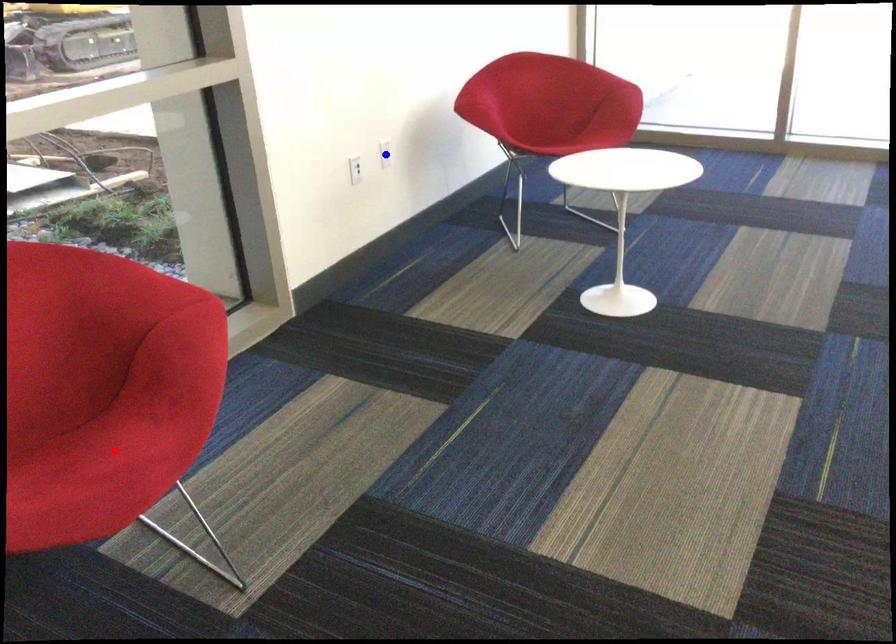
Question: In the image, two points are highlighted. Which point is nearer to the camera? Reply with the corresponding letter.

Choices:
 (A) blue point
 (B) red point

Answer: (B)